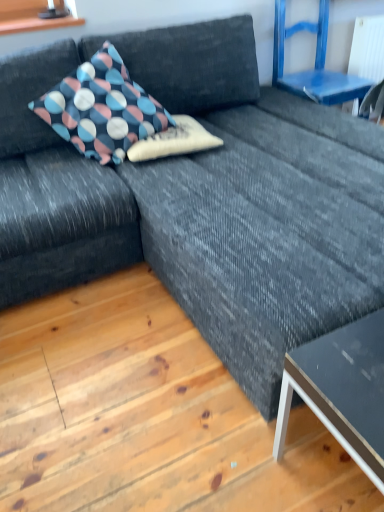
Question: Is polka dot fabric pillow at center, which is the first pillow in right-to-left order, not near polka dot fabric pillow at upper left, the 2th pillow viewed from the right?

Choices:
 (A) no
 (B) yes

Answer: (A)

Question: Considering the relative sizes of polka dot fabric pillow at center, positioned as the 2th pillow in left-to-right order, and polka dot fabric pillow at upper left, the 2th pillow viewed from the right, in the image provided, is polka dot fabric pillow at center, positioned as the 2th pillow in left-to-right order, shorter than polka dot fabric pillow at upper left, the 2th pillow viewed from the right,?

Choices:
 (A) no
 (B) yes

Answer: (B)

Question: Could you tell me if polka dot fabric pillow at center, which is the first pillow in right-to-left order, is turned towards polka dot fabric pillow at upper left, the 1th pillow in the left-to-right sequence?

Choices:
 (A) yes
 (B) no

Answer: (A)

Question: Can you confirm if polka dot fabric pillow at center, which is the first pillow in right-to-left order, is thinner than polka dot fabric pillow at upper left, the 1th pillow in the left-to-right sequence?

Choices:
 (A) no
 (B) yes

Answer: (B)

Question: Does polka dot fabric pillow at center, positioned as the 2th pillow in left-to-right order, have a greater height compared to polka dot fabric pillow at upper left, the 1th pillow in the left-to-right sequence?

Choices:
 (A) no
 (B) yes

Answer: (A)

Question: From the image's perspective, is polka dot fabric pillow at center, positioned as the 2th pillow in left-to-right order, below polka dot fabric pillow at upper left, the 1th pillow in the left-to-right sequence?

Choices:
 (A) no
 (B) yes

Answer: (B)

Question: Is blue painted wood chair at upper right oriented away from matte black table at lower right?

Choices:
 (A) no
 (B) yes

Answer: (A)

Question: Can you confirm if blue painted wood chair at upper right is wider than matte black table at lower right?

Choices:
 (A) no
 (B) yes

Answer: (B)

Question: Considering the relative sizes of blue painted wood chair at upper right and matte black table at lower right in the image provided, is blue painted wood chair at upper right taller than matte black table at lower right?

Choices:
 (A) no
 (B) yes

Answer: (B)

Question: Is there a large distance between blue painted wood chair at upper right and matte black table at lower right?

Choices:
 (A) yes
 (B) no

Answer: (A)

Question: From the image's perspective, does blue painted wood chair at upper right appear higher than matte black table at lower right?

Choices:
 (A) yes
 (B) no

Answer: (A)

Question: Does blue painted wood chair at upper right lie in front of matte black table at lower right?

Choices:
 (A) no
 (B) yes

Answer: (A)

Question: From the image's perspective, is polka dot fabric pillow at upper left, the 2th pillow viewed from the right, over blue painted wood chair at upper right?

Choices:
 (A) yes
 (B) no

Answer: (B)